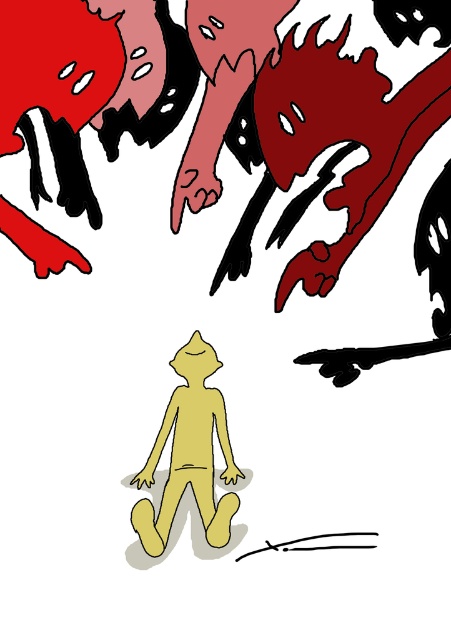
You are an artist analyzing the composition of the image. You notice the smooth red zombie at upper right and the yellow matte figure at center. Based on their positions, which object is placed higher in the image?

The smooth red zombie at upper right is placed higher in the image than the yellow matte figure at center because it is positioned above the yellow matte figure at center.

You are an artist analyzing the composition of this abstract drawing. You notice the smooth red zombie at upper right and the yellow matte figure at center. Which of these two objects occupies more visual space in the artwork?

The smooth red zombie at upper right has a larger size compared to the yellow matte figure at center, so it occupies more visual space in the artwork.

You are an artist looking at the abstract drawing. You notice two points marked in the image. The first point is at coordinates point (443, 104) and the second is at point (146, 467). Which point is closer to the central figure?

Point (146, 467) is closer to the central figure because it is in front of point (443, 104), which is behind it.